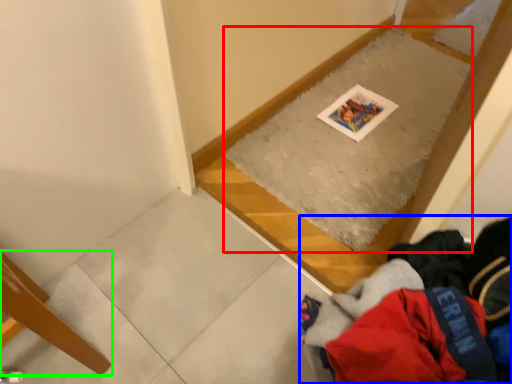
Question: Which is nearer to the mat (highlighted by a red box)? clothing (highlighted by a blue box) or furniture (highlighted by a green box).

Choices:
 (A) clothing
 (B) furniture

Answer: (A)